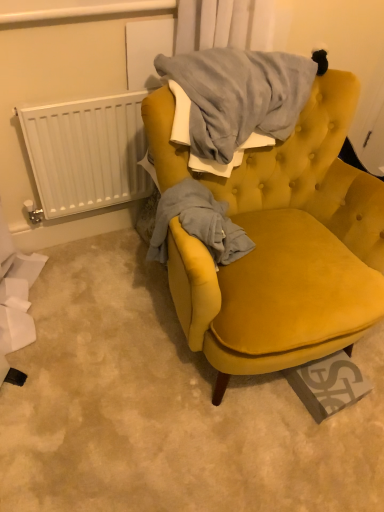
Question: Considering the relative sizes of velvet yellow armchair at center and white plastic radiator at left in the image provided, is velvet yellow armchair at center thinner than white plastic radiator at left?

Choices:
 (A) no
 (B) yes

Answer: (A)

Question: From a real-world perspective, is velvet yellow armchair at center physically below white plastic radiator at left?

Choices:
 (A) no
 (B) yes

Answer: (B)

Question: Is white plastic radiator at left located within velvet yellow armchair at center?

Choices:
 (A) no
 (B) yes

Answer: (A)

Question: Is velvet yellow armchair at center turned away from white plastic radiator at left?

Choices:
 (A) yes
 (B) no

Answer: (B)

Question: Considering the relative sizes of velvet yellow armchair at center and white plastic radiator at left in the image provided, is velvet yellow armchair at center smaller than white plastic radiator at left?

Choices:
 (A) no
 (B) yes

Answer: (A)

Question: Does velvet yellow armchair at center appear on the left side of white plastic radiator at left?

Choices:
 (A) yes
 (B) no

Answer: (B)

Question: Considering the relative sizes of white plastic radiator at left and velvet yellow armchair at center in the image provided, is white plastic radiator at left thinner than velvet yellow armchair at center?

Choices:
 (A) yes
 (B) no

Answer: (A)

Question: From the image's perspective, is white plastic radiator at left below velvet yellow armchair at center?

Choices:
 (A) no
 (B) yes

Answer: (A)

Question: Can you confirm if white plastic radiator at left is taller than velvet yellow armchair at center?

Choices:
 (A) no
 (B) yes

Answer: (A)

Question: Is white plastic radiator at left to the right of velvet yellow armchair at center from the viewer's perspective?

Choices:
 (A) no
 (B) yes

Answer: (A)

Question: Is white plastic radiator at left turned away from velvet yellow armchair at center?

Choices:
 (A) no
 (B) yes

Answer: (A)

Question: Does white plastic radiator at left appear on the left side of velvet yellow armchair at center?

Choices:
 (A) yes
 (B) no

Answer: (A)

Question: Is point (129, 157) positioned closer to the camera than point (306, 343)?

Choices:
 (A) farther
 (B) closer

Answer: (A)